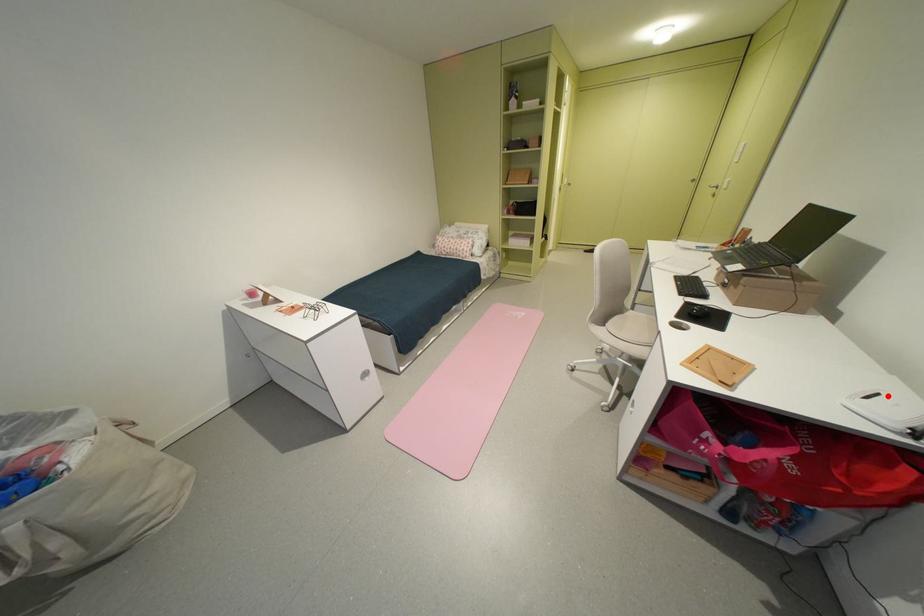
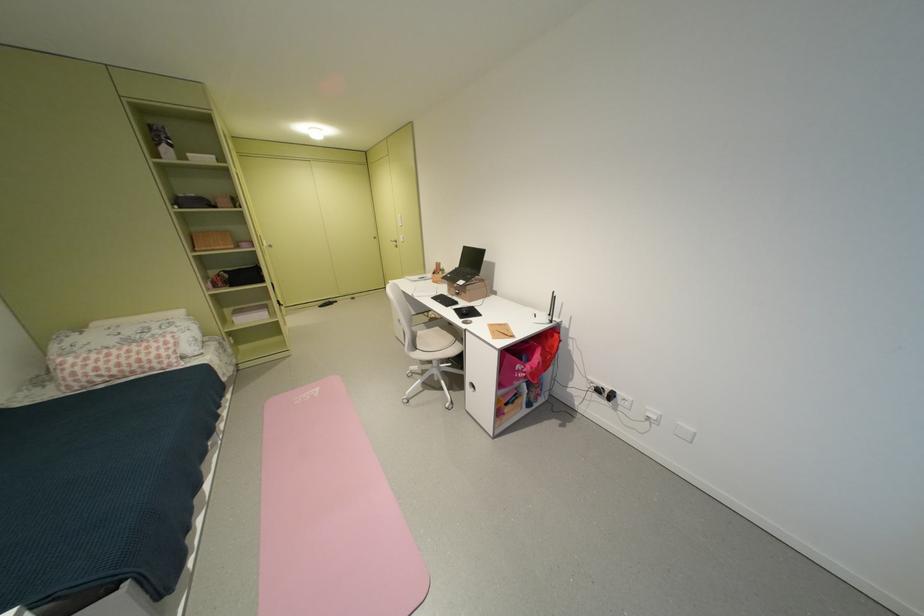
In the second image, find the point that corresponds to the highlighted location in the first image.

(544, 315)